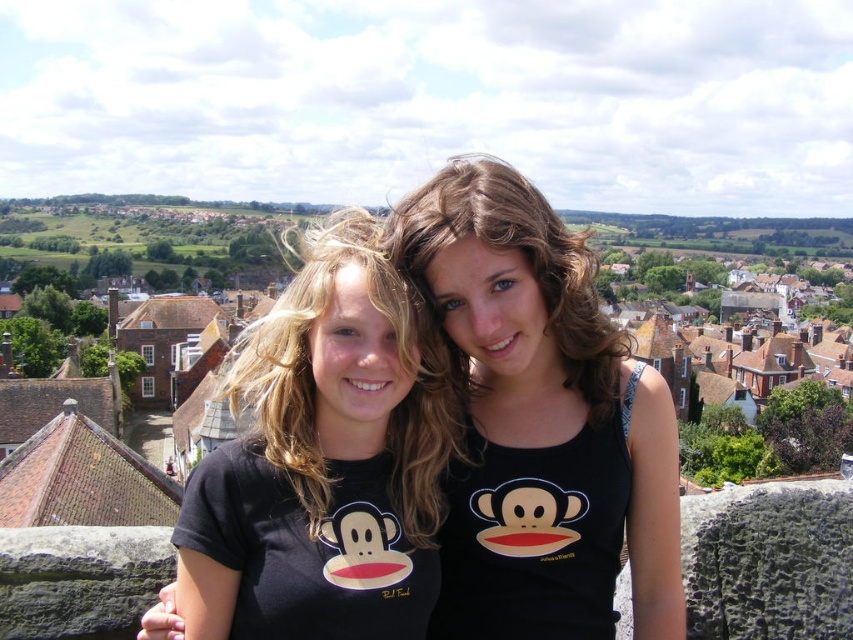
Question: Which of the following is the closest to the observer?

Choices:
 (A) (331, 451)
 (B) (424, 208)

Answer: (A)

Question: Is black matte tank top at center further to camera compared to black matte t-shirt at center?

Choices:
 (A) no
 (B) yes

Answer: (B)

Question: Is black matte t-shirt at center to the right of matte black shirt at center from the viewer's perspective?

Choices:
 (A) no
 (B) yes

Answer: (A)

Question: Which point is closer to the camera?

Choices:
 (A) (585, 616)
 (B) (430, 284)
 (C) (239, 385)

Answer: (A)

Question: Based on their relative distances, which object is farther from the black matte t-shirt at center?

Choices:
 (A) matte black shirt at center
 (B) black matte tank top at center

Answer: (A)

Question: Is black matte tank top at center bigger than black matte t-shirt at center?

Choices:
 (A) yes
 (B) no

Answer: (B)